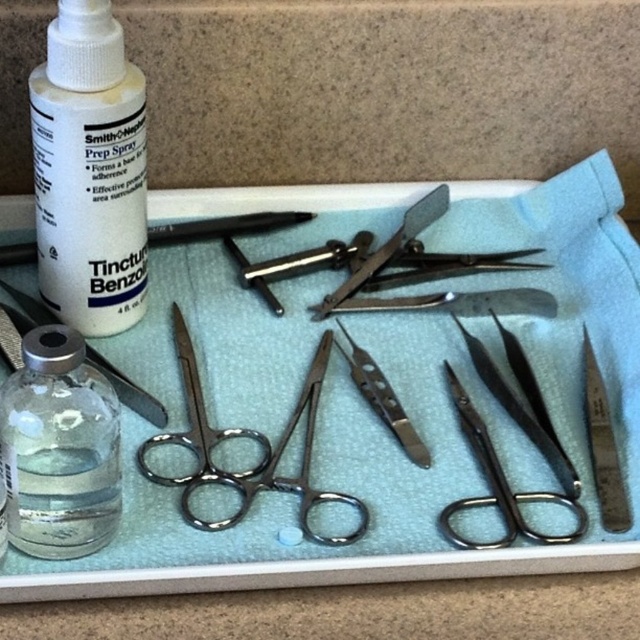
You are a medical assistant and need to locate the white plastic bottle at upper left on the tray. What are its coordinates?

The white plastic bottle at upper left is located at coordinates point (90,172).

You are a medical assistant preparing for a procedure. You need to locate the transparent glass bottle at left on the tray. Where exactly is it positioned?

The transparent glass bottle at left is positioned at point (60, 449) on the tray.

You are a surgeon preparing for a procedure and need to locate two specific points on the medical tray. The first point is at coordinates point (61, 65), and the second is at point (196, 378). From your perspective standing at the edge of the tray, which point is closer to you?

Point (61, 65) is in front of point (196, 378), so it is closer to you.